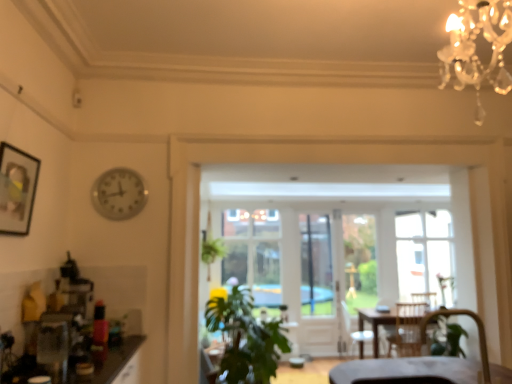
Measure the distance between green leafy plant at center and camera.

The depth of green leafy plant at center is 3.34 meters.

What is the approximate width of wooden armchair at center, the 2th armchair when ordered from front to back?

19.13 inches.

Where is `metallic clock at upper left`? The width and height of the screenshot is (512, 384). metallic clock at upper left is located at coordinates (119, 194).

The width and height of the screenshot is (512, 384). Describe the element at coordinates (17, 189) in the screenshot. I see `matte black picture frame at upper left` at that location.

What do you see at coordinates (253, 253) in the screenshot? This screenshot has height=384, width=512. I see `clear glass window at center` at bounding box center [253, 253].

What is the approximate width of clear glass window at center?

It is 11.87 inches.

Where is `clear glass screen door at center`? Image resolution: width=512 pixels, height=384 pixels. clear glass screen door at center is located at coordinates (318, 285).

Does point (475, 314) lie behind point (127, 201)?

Yes, it is.

From the image's perspective, is velvet brown armchair at lower right, the 1th armchair when ordered from top to bottom, above or below metallic clock at upper left?

From the image's perspective, velvet brown armchair at lower right, the 1th armchair when ordered from top to bottom, appears below metallic clock at upper left.

Can you confirm if velvet brown armchair at lower right, the 2th armchair positioned from the back, is positioned to the left of metallic clock at upper left?

No.

Is velvet brown armchair at lower right, the 1th armchair positioned from the left, next to metallic clock at upper left?

velvet brown armchair at lower right, the 1th armchair positioned from the left, and metallic clock at upper left are clearly separated.

Could you tell me if wooden armchair at center, which ranks as the 2th armchair in top-to-bottom order, is turned towards clear glass screen door at center?

No, wooden armchair at center, which ranks as the 2th armchair in top-to-bottom order, is not aimed at clear glass screen door at center.

Identify the location of armchair that is the 1st object located in front of the clear glass screen door at center. The width and height of the screenshot is (512, 384). (355, 332).

In terms of size, does wooden armchair at center, which ranks as the 1th armchair in back-to-front order, appear bigger or smaller than clear glass screen door at center?

In the image, wooden armchair at center, which ranks as the 1th armchair in back-to-front order, appears to be larger than clear glass screen door at center.

From a real-world perspective, is wooden armchair at center, which ranks as the 2th armchair in top-to-bottom order, positioned above or below clear glass screen door at center?

wooden armchair at center, which ranks as the 2th armchair in top-to-bottom order, is situated lower than clear glass screen door at center in the real world.

Is velvet brown armchair at lower right, the 1th armchair when ordered from top to bottom, oriented away from wooden armchair at center, which is counted as the 1th armchair, starting from the bottom?

No.

Are velvet brown armchair at lower right, the 1th armchair when ordered from top to bottom, and wooden armchair at center, which is counted as the 2th armchair, starting from the left, making contact?

No, velvet brown armchair at lower right, the 1th armchair when ordered from top to bottom, is not with wooden armchair at center, which is counted as the 2th armchair, starting from the left.

Which point is more forward, (443,313) or (350,325)?

The point (443,313) is in front.

Considering the relative positions of velvet brown armchair at lower right, which is the 2th armchair in bottom-to-top order, and wooden armchair at center, the 2th armchair when ordered from front to back, in the image provided, is velvet brown armchair at lower right, which is the 2th armchair in bottom-to-top order, behind wooden armchair at center, the 2th armchair when ordered from front to back,?

No, the depth of velvet brown armchair at lower right, which is the 2th armchair in bottom-to-top order, is less than that of wooden armchair at center, the 2th armchair when ordered from front to back.

Is wooden armchair at center, which is counted as the 1th armchair, starting from the bottom, not close to velvet brown armchair at lower right, the 2th armchair positioned from the back?

That's right, there is a large distance between wooden armchair at center, which is counted as the 1th armchair, starting from the bottom, and velvet brown armchair at lower right, the 2th armchair positioned from the back.

From a real-world perspective, which is physically below, wooden armchair at center, which is counted as the 1th armchair, starting from the bottom, or velvet brown armchair at lower right, the second armchair from the right?

From a 3D spatial view, wooden armchair at center, which is counted as the 1th armchair, starting from the bottom, is below.

Considering the positions of objects wooden armchair at center, the 2th armchair when ordered from front to back, and velvet brown armchair at lower right, the 1th armchair when ordered from top to bottom, in the image provided, who is more to the right, wooden armchair at center, the 2th armchair when ordered from front to back, or velvet brown armchair at lower right, the 1th armchair when ordered from top to bottom,?

wooden armchair at center, the 2th armchair when ordered from front to back.

Between point (360, 331) and point (485, 349), which one is positioned behind?

The point (360, 331) is farther from the camera.

Where is `houseplant that appears on the right of matte black picture frame at upper left`? This screenshot has height=384, width=512. houseplant that appears on the right of matte black picture frame at upper left is located at coordinates (245, 339).

Can matte black picture frame at upper left be found inside green leafy plant at center?

No, matte black picture frame at upper left is not inside green leafy plant at center.

From the image's perspective, which one is positioned lower, green leafy plant at center or matte black picture frame at upper left?

green leafy plant at center, from the image's perspective.

Considering the relative positions of green leafy plant at center and matte black picture frame at upper left in the image provided, is green leafy plant at center to the left of matte black picture frame at upper left from the viewer's perspective?

No.

Is the depth of velvet brown armchair at lower right, which appears as the first armchair when viewed from the front, greater than that of clear glass window at center?

No, it is in front of clear glass window at center.

Could you tell me if velvet brown armchair at lower right, the 2th armchair positioned from the back, is turned towards clear glass window at center?

No, velvet brown armchair at lower right, the 2th armchair positioned from the back, is not aimed at clear glass window at center.

Considering the relative sizes of velvet brown armchair at lower right, the second armchair from the right, and clear glass window at center in the image provided, is velvet brown armchair at lower right, the second armchair from the right, thinner than clear glass window at center?

Indeed, velvet brown armchair at lower right, the second armchair from the right, has a lesser width compared to clear glass window at center.

How much distance is there between velvet brown armchair at lower right, the second armchair from the right, and clear glass window at center?

velvet brown armchair at lower right, the second armchair from the right, and clear glass window at center are 2.75 meters apart from each other.

From a real-world perspective, which object stands above the other?

clear glass window at center is physically above.

Which of these two, clear glass window at center or clear glass screen door at center, stands taller?

clear glass screen door at center.

Do you think clear glass window at center is within clear glass screen door at center, or outside of it?

clear glass window at center lies outside clear glass screen door at center.

What's the angular difference between clear glass window at center and clear glass screen door at center's facing directions?

The facing directions of clear glass window at center and clear glass screen door at center are 0.264 degrees apart.

There is a metallic clock at upper left. Where is `the 1st armchair below it (from a real-world perspective)`? The height and width of the screenshot is (384, 512). the 1st armchair below it (from a real-world perspective) is located at coordinates (478, 332).

Find the location of a particular element. screen door above the wooden armchair at center, which is counted as the 2th armchair, starting from the left (from the image's perspective) is located at coordinates (318, 285).

From the image, which object appears to be nearer to clear glass screen door at center, metallic clock at upper left or velvet brown armchair at lower right, which is the 2th armchair in bottom-to-top order?

Among the two, velvet brown armchair at lower right, which is the 2th armchair in bottom-to-top order, is located nearer to clear glass screen door at center.

From the image, which object appears to be farther from green leafy plant at center, velvet brown armchair at lower right, the 2th armchair positioned from the back, or metallic clock at upper left?

Based on the image, velvet brown armchair at lower right, the 2th armchair positioned from the back, appears to be further to green leafy plant at center.

Estimate the real-world distances between objects in this image. Which object is further from velvet brown armchair at lower right, which appears as the first armchair when viewed from the front, metallic clock at upper left or clear glass screen door at center?

The object further to velvet brown armchair at lower right, which appears as the first armchair when viewed from the front, is metallic clock at upper left.

Looking at this image, which object lies further to the anchor point green leafy plant at center, matte black picture frame at upper left or velvet brown armchair at lower right, the 1th armchair positioned from the left?

matte black picture frame at upper left lies further to green leafy plant at center than the other object.

Which object lies nearer to the anchor point clear glass screen door at center, wooden armchair at center, which is counted as the 1th armchair, starting from the bottom, or green leafy plant at center?

wooden armchair at center, which is counted as the 1th armchair, starting from the bottom, lies closer to clear glass screen door at center than the other object.

Based on their spatial positions, is green leafy plant at center or matte black picture frame at upper left further from clear glass screen door at center?

Based on the image, matte black picture frame at upper left appears to be further to clear glass screen door at center.

Which object lies further to the anchor point green leafy plant at center, clear glass screen door at center or velvet brown armchair at lower right, the 2th armchair positioned from the back?

clear glass screen door at center is positioned further to the anchor green leafy plant at center.

From the picture: Estimate the real-world distances between objects in this image. Which object is closer to green leafy plant at center, wooden armchair at center, acting as the first armchair starting from the right, or clear glass screen door at center?

Among the two, wooden armchair at center, acting as the first armchair starting from the right, is located nearer to green leafy plant at center.

Image resolution: width=512 pixels, height=384 pixels. I want to click on houseplant positioned between velvet brown armchair at lower right, the second armchair from the right, and wooden armchair at center, the 2th armchair when ordered from front to back, from near to far, so click(x=245, y=339).

Where is `armchair between green leafy plant at center and clear glass screen door at center in the front-back direction`? The image size is (512, 384). armchair between green leafy plant at center and clear glass screen door at center in the front-back direction is located at coordinates (355, 332).

At what (x,y) coordinates should I click in order to perform the action: click on clock between matte black picture frame at upper left and green leafy plant at center in the vertical direction. Please return your answer as a coordinate pair (x, y). Looking at the image, I should click on (119, 194).

The width and height of the screenshot is (512, 384). I want to click on clock between matte black picture frame at upper left and wooden armchair at center, which ranks as the 2th armchair in top-to-bottom order, from front to back, so (119, 194).